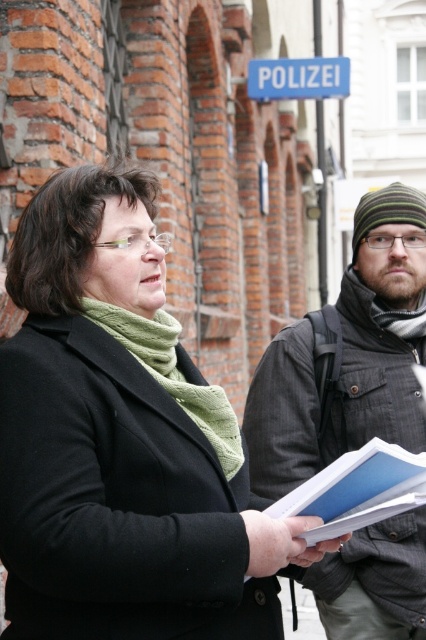
Measure the distance between point (317, 476) and camera.

They are 21.60 meters apart.

Is point (359, 474) more distant than point (157, 332)?

No, (359, 474) is closer to viewer.

Locate an element on the screen. blue paper at center is located at coordinates (356, 490).

Can you confirm if dark gray textured jacket at center is positioned to the right of blue plastic sign at upper center?

Incorrect, dark gray textured jacket at center is not on the right side of blue plastic sign at upper center.

Who is positioned more to the right, dark gray textured jacket at center or blue plastic sign at upper center?

Positioned to the right is blue plastic sign at upper center.

Does point (291, 355) come farther from viewer compared to point (268, 86)?

No, it is in front of (268, 86).

This screenshot has width=426, height=640. I want to click on dark gray textured jacket at center, so click(348, 355).

Is green knitted scarf at left positioned behind blue plastic sign at upper center?

No, green knitted scarf at left is closer to the viewer.

Between green knitted scarf at left and blue plastic sign at upper center, which one is positioned lower?

green knitted scarf at left is below.

Find the location of a particular element. This screenshot has width=426, height=640. green knitted scarf at left is located at coordinates (172, 374).